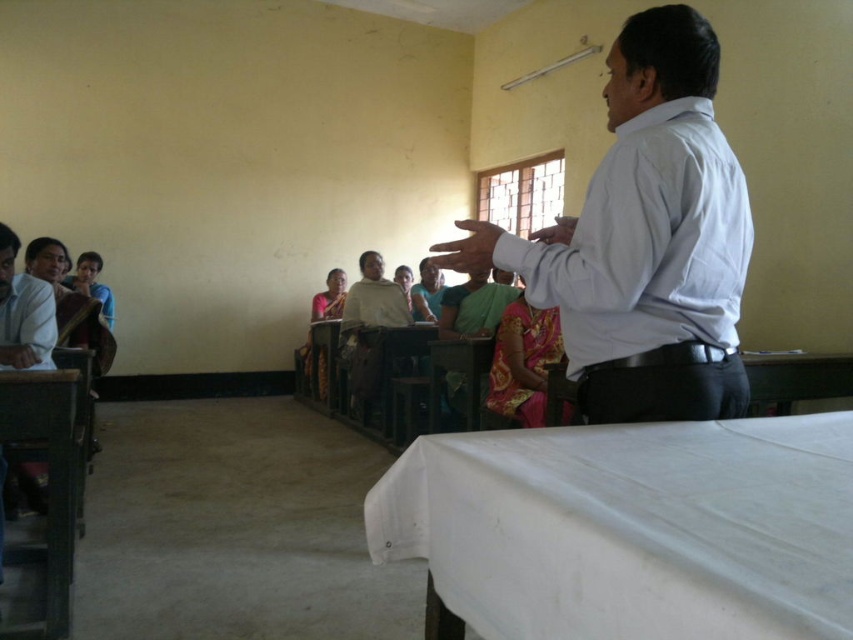
Question: Can you confirm if white fabric table at lower right is bigger than white shirt at upper right?

Choices:
 (A) yes
 (B) no

Answer: (B)

Question: Is white shirt at upper right positioned behind wooden table at lower left?

Choices:
 (A) no
 (B) yes

Answer: (A)

Question: Among these objects, which one is nearest to the camera?

Choices:
 (A) white fabric table at lower right
 (B) white shirt at upper right
 (C) wooden table at lower left
 (D) light brown wooden desk at left

Answer: (A)

Question: Which point is farther to the camera?

Choices:
 (A) light brown wooden desk at left
 (B) white shirt at upper right
 (C) white fabric table at lower right

Answer: (A)

Question: Among these points, which one is nearest to the camera?

Choices:
 (A) (3, 502)
 (B) (665, 355)
 (C) (482, 580)

Answer: (C)

Question: Is white shirt at upper right smaller than wooden table at lower left?

Choices:
 (A) no
 (B) yes

Answer: (A)